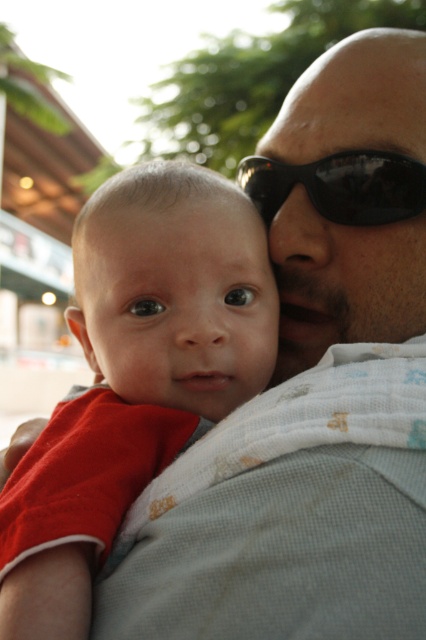
You are a photographer trying to focus on the red cotton shirt at left and the black glossy sunglasses at center in this image. Since the background is blurred, which object do you think is closer to the camera?

The red cotton shirt at left is bigger than the black glossy sunglasses at center, so it is closer to the camera because larger objects in a blurred background are typically nearer to the focal point.

You are a photographer adjusting the lighting for a portrait. You notice the red cotton shirt at left and the black glossy sunglasses at center. Which object is closer to the bottom edge of the photo?

The red cotton shirt at left is positioned under the black glossy sunglasses at center, so it is closer to the bottom edge of the photo.

You are a photographer who wants to ensure the red cotton shirt at left and the black glossy sunglasses at center are both visible in your photo. Given their sizes, which object should you focus on to ensure both fit in the frame?

The red cotton shirt at left is wider than the black glossy sunglasses at center, so you should focus on the larger object, the red cotton shirt at left, to ensure both fit in the frame.